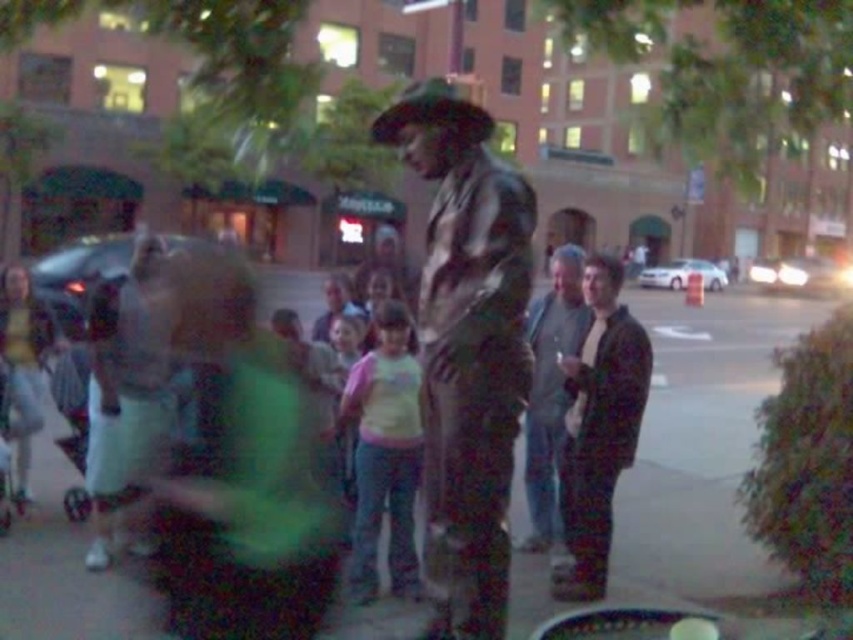
How far apart are shiny brown leather jacket at center and gray fabric jacket at center?

shiny brown leather jacket at center is 1.24 meters from gray fabric jacket at center.

Describe the element at coordinates (467, 349) in the screenshot. I see `shiny brown leather jacket at center` at that location.

Identify the location of shiny brown leather jacket at center. The width and height of the screenshot is (853, 640). (467, 349).

Which of these two, green fabric at center or gray fabric jacket at center, stands shorter?

green fabric at center

The image size is (853, 640). What do you see at coordinates (701, 451) in the screenshot? I see `green fabric at center` at bounding box center [701, 451].

You are a GUI agent. You are given a task and a screenshot of the screen. Output one action in this format:
    pyautogui.click(x=<x>, y=<y>)
    Task: Click on the green fabric at center
    The width and height of the screenshot is (853, 640).
    Given the screenshot: What is the action you would take?
    pyautogui.click(x=701, y=451)

Is green fabric at center bigger than shiny brown leather jacket at center?

Yes.

Does green fabric at center appear over shiny brown leather jacket at center?

No.

Between point (682, 516) and point (476, 125), which one is positioned in front?

Point (476, 125) is in front.

This screenshot has height=640, width=853. Find the location of `green fabric at center`. green fabric at center is located at coordinates (701, 451).